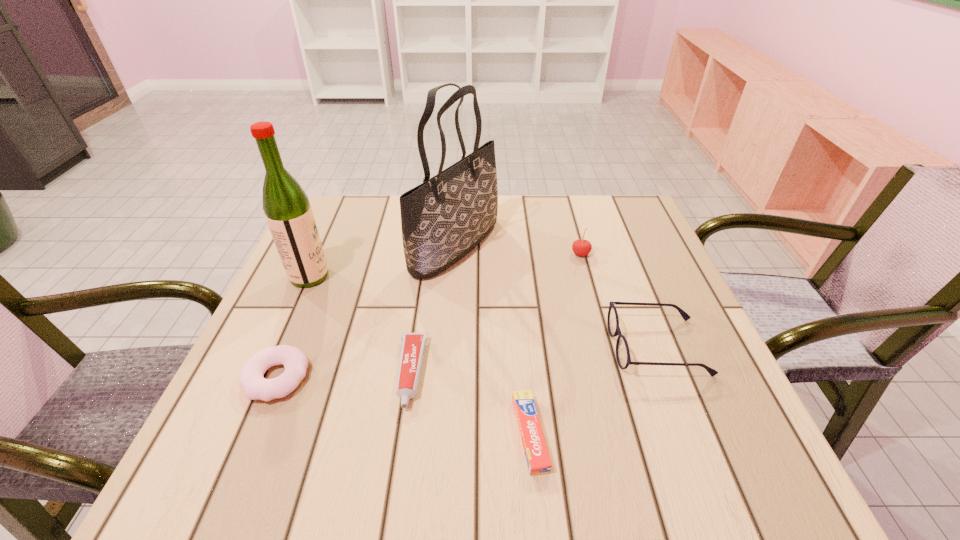
In order to click on free point that satisfies the following two spatial constraints: 1. on the label of the right toothpaste; 2. on the left side of the liquor in this screenshot , I will do `click(239, 434)`.

Where is `free spot that satisfies the following two spatial constraints: 1. on the label of the doughnut; 2. on the left side of the liquor`? The image size is (960, 540). free spot that satisfies the following two spatial constraints: 1. on the label of the doughnut; 2. on the left side of the liquor is located at coordinates (265, 377).

You are a GUI agent. You are given a task and a screenshot of the screen. Output one action in this format:
    pyautogui.click(x=<x>, y=<y>)
    Task: Click on the vacant region that satisfies the following two spatial constraints: 1. on the front-facing side of the fourth tallest object; 2. at the nozzle of the left toothpaste
    The image size is (960, 540).
    Given the screenshot: What is the action you would take?
    pyautogui.click(x=667, y=373)

Locate an element on the screen. vacant space that satisfies the following two spatial constraints: 1. on the front side of the tote bag; 2. on the right side of the third tallest object is located at coordinates (455, 254).